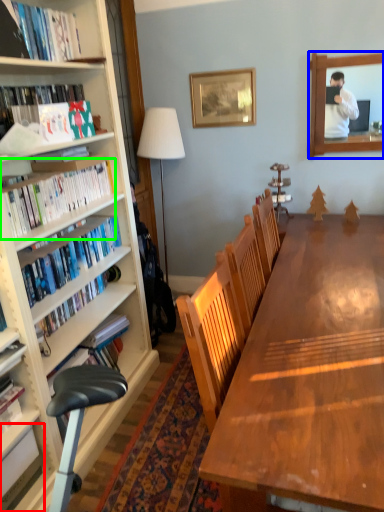
Question: Which object is the farthest from book (highlighted by a red box)? Choose among these: mirror (highlighted by a blue box) or book (highlighted by a green box).

Choices:
 (A) mirror
 (B) book

Answer: (A)